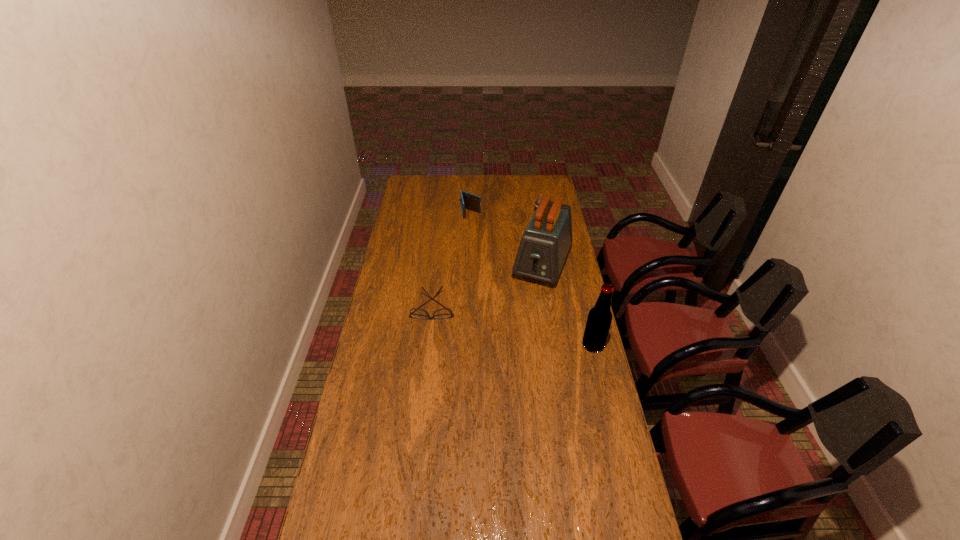
Locate an element on the screen. The width and height of the screenshot is (960, 540). the shortest object is located at coordinates (443, 313).

Find the location of `the fourth farthest object`. the fourth farthest object is located at coordinates (443, 313).

At what (x,y) coordinates should I click in order to perform the action: click on beer bottle. Please return your answer as a coordinate pair (x, y). Looking at the image, I should click on (599, 319).

Find the location of a particular element. kitten is located at coordinates (540, 199).

In order to click on the fourth object from right to left in this screenshot , I will do `click(469, 201)`.

Identify the location of the third farthest object. This screenshot has width=960, height=540. (544, 246).

You are a GUI agent. You are given a task and a screenshot of the screen. Output one action in this format:
    pyautogui.click(x=<x>, y=<y>)
    Task: Click on the free point located 0.300m on the front-facing side of the leftmost object
    
    Given the screenshot: What is the action you would take?
    pyautogui.click(x=424, y=380)

Where is `free point located 0.350m on the back of the beer bottle`? Image resolution: width=960 pixels, height=540 pixels. free point located 0.350m on the back of the beer bottle is located at coordinates (577, 279).

Locate an element on the screen. Image resolution: width=960 pixels, height=540 pixels. vacant space located on the front-facing side of the kitten is located at coordinates (533, 259).

Locate an element on the screen. vacant space situated on the front-facing side of the kitten is located at coordinates (533, 255).